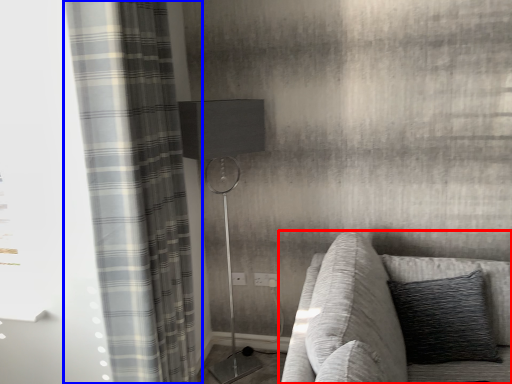
Question: Which of the following is the farthest to the observer, studio couch (highlighted by a red box) or curtain (highlighted by a blue box)?

Choices:
 (A) studio couch
 (B) curtain

Answer: (B)